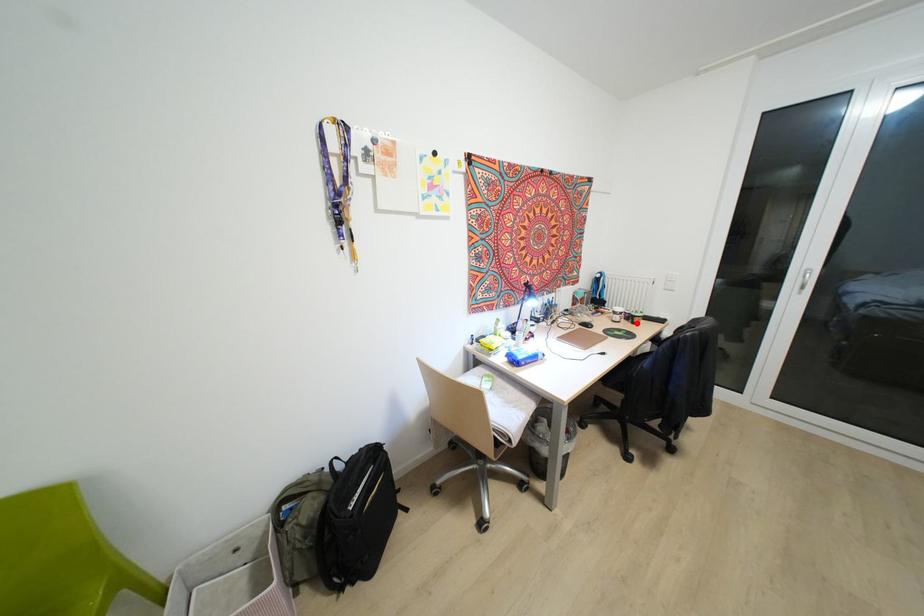
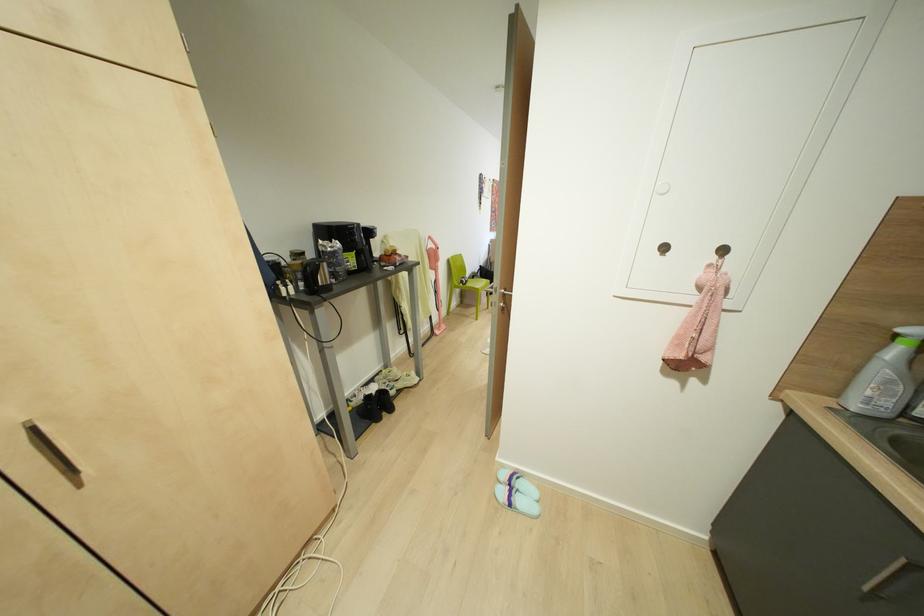
Question: I am providing you with two images of the same scene from different viewpoints. A red point is marked on the first image. Is the red point's position out of view in image 2?

Choices:
 (A) Yes
 (B) No

Answer: (A)